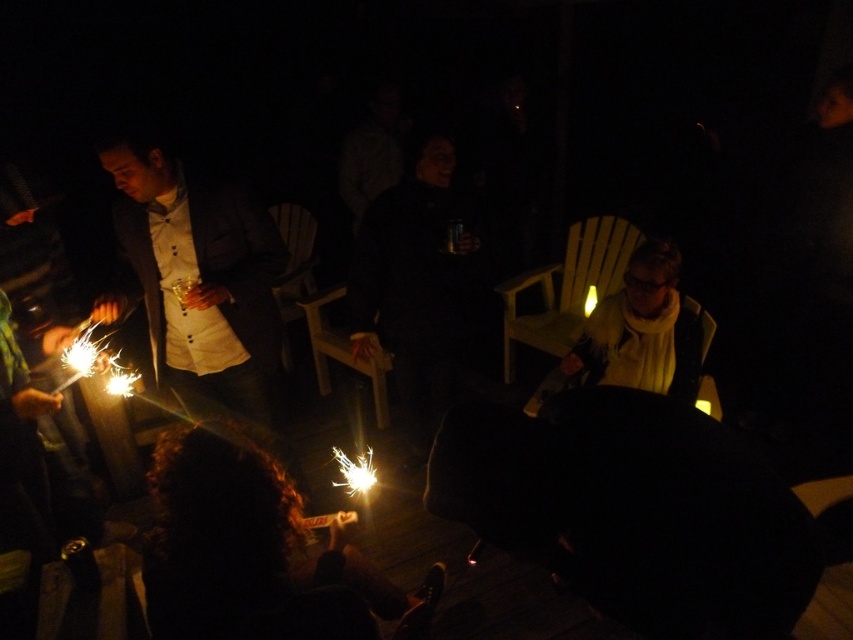
Question: Can you confirm if matte black suit at left is bigger than yellow plastic chair at center?

Choices:
 (A) yes
 (B) no

Answer: (A)

Question: Which point appears closest to the camera in this image?

Choices:
 (A) (328, 324)
 (B) (512, 307)
 (C) (258, 208)

Answer: (C)

Question: Which object is positioned closest to the wooden chair at center?

Choices:
 (A) yellow plastic chair at center
 (B) matte black suit at left
 (C) yellow wood chair at center

Answer: (A)

Question: Does matte black suit at left appear under yellow wood chair at center?

Choices:
 (A) yes
 (B) no

Answer: (A)

Question: Considering the relative positions of wooden chair at center and yellow plastic chair at center in the image provided, where is wooden chair at center located with respect to yellow plastic chair at center?

Choices:
 (A) left
 (B) right

Answer: (B)

Question: Which of the following is the farthest from the observer?

Choices:
 (A) yellow plastic chair at center
 (B) wooden chair at center
 (C) yellow wood chair at center
 (D) matte black suit at left

Answer: (A)